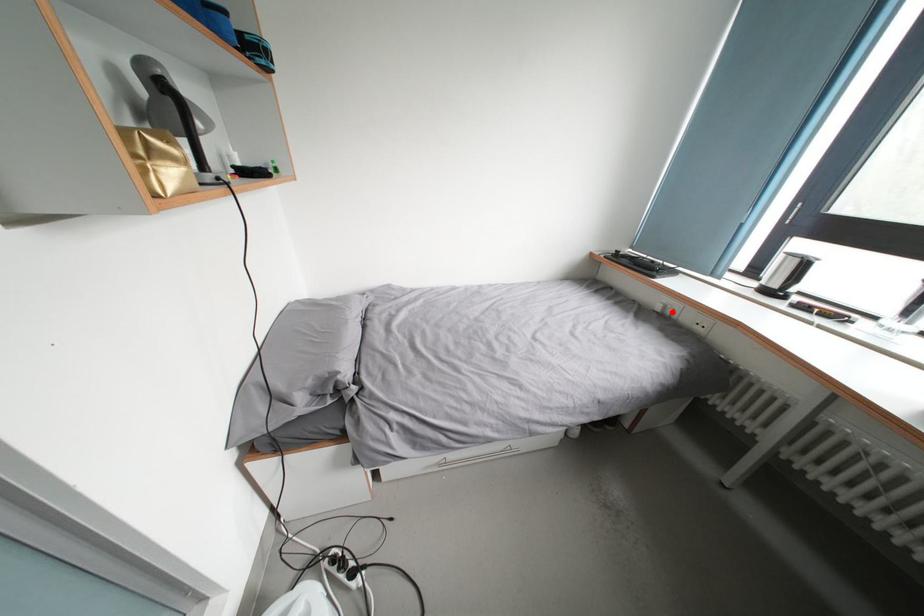
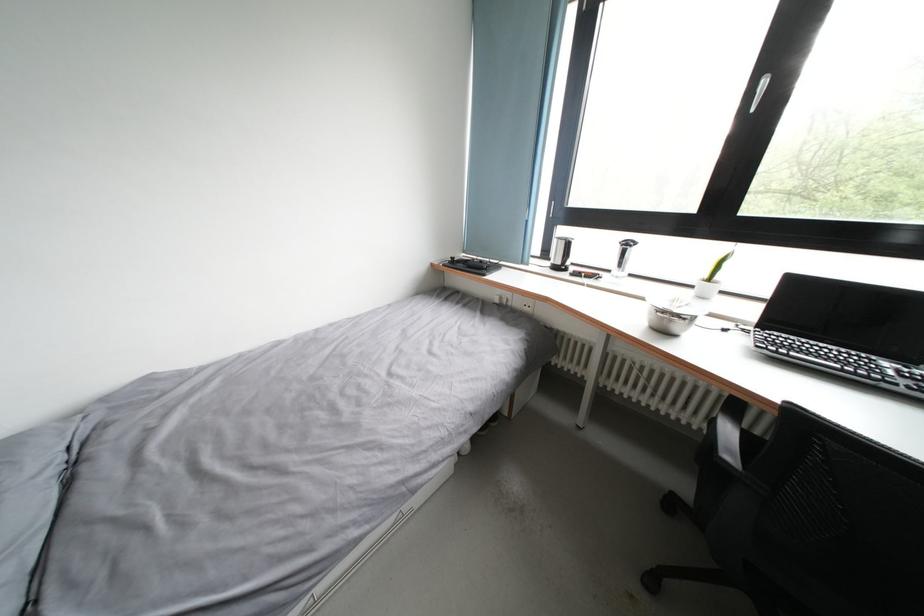
Find the pixel in the second image that matches the highlighted location in the first image.

(507, 302)